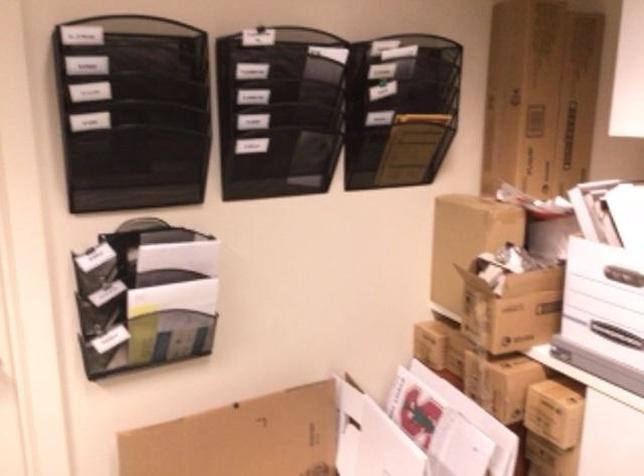
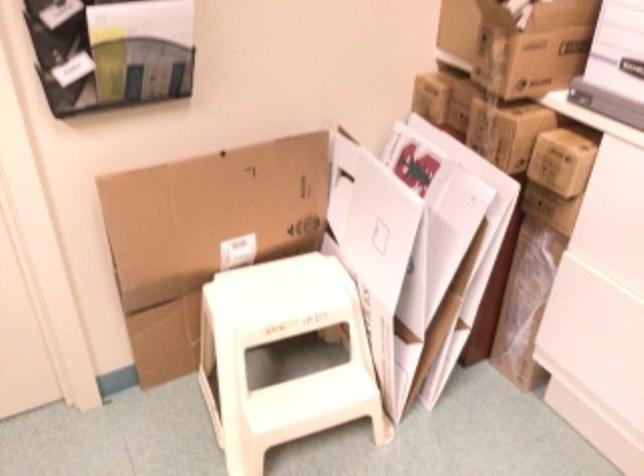
Where in the second image is the point corresponding to the point at 431,346 from the first image?

(431, 96)